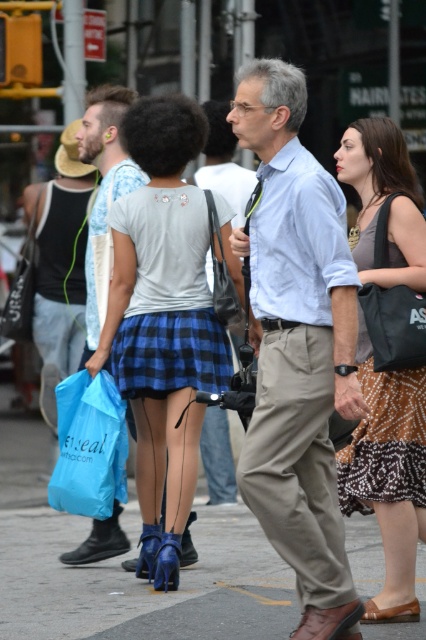
Does brown dotted skirt at center have a greater width compared to blue plaid skirt at center?

Yes, brown dotted skirt at center is wider than blue plaid skirt at center.

Is brown dotted skirt at center taller than blue plaid skirt at center?

Yes, brown dotted skirt at center is taller than blue plaid skirt at center.

Image resolution: width=426 pixels, height=640 pixels. In order to click on brown dotted skirt at center in this screenshot , I will do `click(388, 476)`.

Does matte blue skirt at center have a lesser height compared to brown dotted skirt at center?

In fact, matte blue skirt at center may be taller than brown dotted skirt at center.

Who is more distant from viewer, (149, 305) or (386, 611)?

Point (149, 305)

Identify the location of matte blue skirt at center. (163, 321).

Between brown dotted skirt at center and blue plastic bag at lower left, which one appears on the left side from the viewer's perspective?

From the viewer's perspective, blue plastic bag at lower left appears more on the left side.

Can you confirm if brown dotted skirt at center is thinner than blue plastic bag at lower left?

Correct, brown dotted skirt at center's width is less than blue plastic bag at lower left's.

Who is more forward, [408,266] or [111,490]?

Point [408,266]

Locate an element on the screen. brown dotted skirt at center is located at coordinates (388, 476).